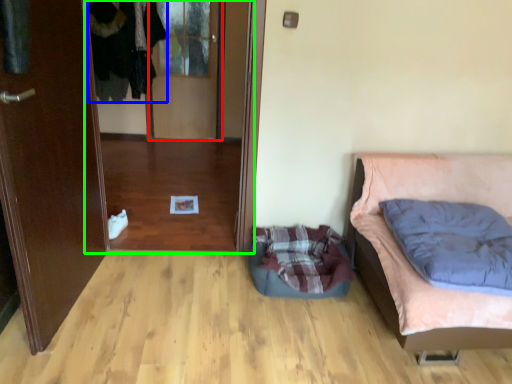
Question: Based on their relative distances, which object is farther from glass door (highlighted by a red box)? Choose from clothing (highlighted by a blue box) and glass door (highlighted by a green box).

Choices:
 (A) clothing
 (B) glass door

Answer: (B)